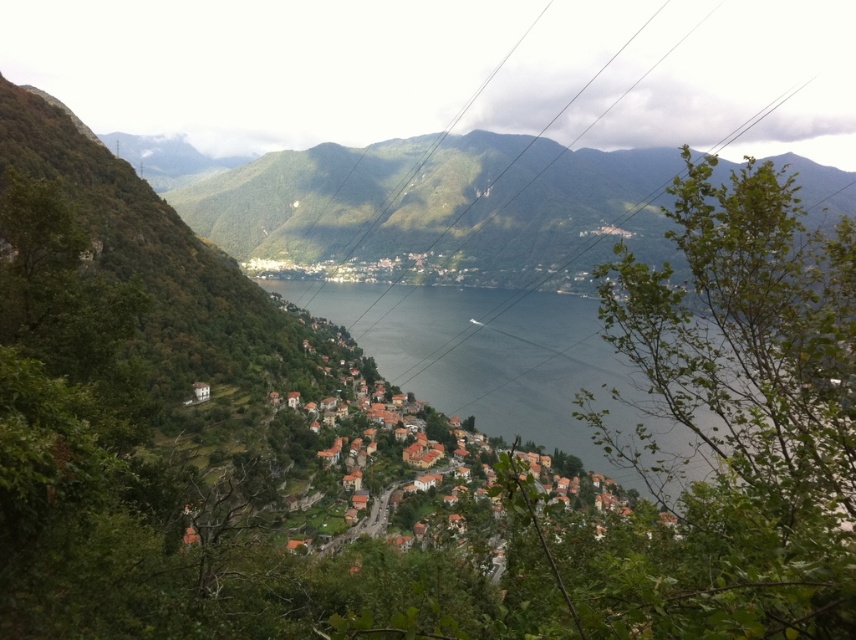
You are standing at the point with coordinates [440,205] in the image. What object is located exactly at this point?

The point at coordinates [440,205] is occupied by the green matte mountain at center.

You are standing at the edge of the small town and want to take a photo of the green matte mountain at center. According to the image, where exactly should you position your camera to capture the mountain in the frame?

To capture the green matte mountain at center, position your camera at the coordinates specified by the point (440, 205), as that is the 2D location of the mountain in the image.